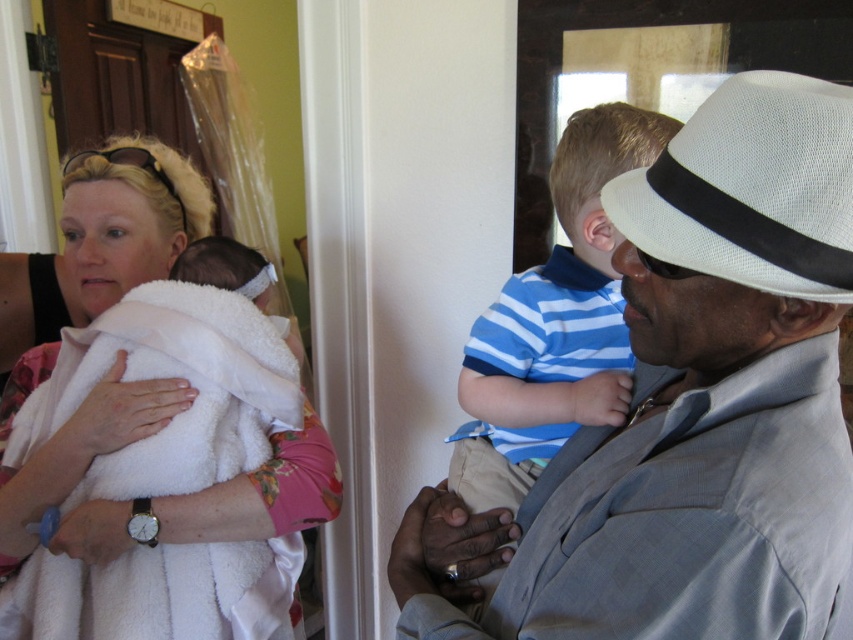
You are a photographer standing at the center of the scene. You need to take a photo that includes both the light gray checkered suit at center and the white fluffy towel at left. What is the minimum distance you should maintain between the camera and these objects to ensure both are in frame?

The minimum distance should be at least 23.52 inches to ensure both the light gray checkered suit at center and the white fluffy towel at left are in frame since they are 23.52 inches apart.